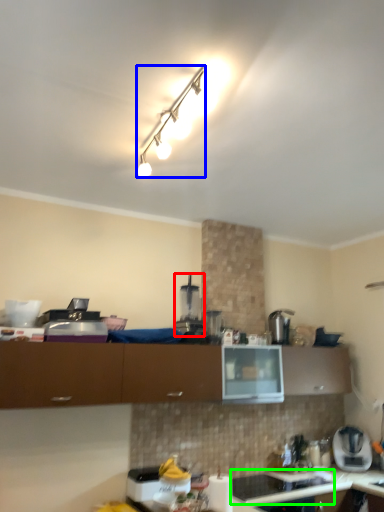
Question: Which is nearer to the coffee machine (highlighted by a red box)? lamp (highlighted by a blue box) or appliance (highlighted by a green box).

Choices:
 (A) lamp
 (B) appliance

Answer: (A)